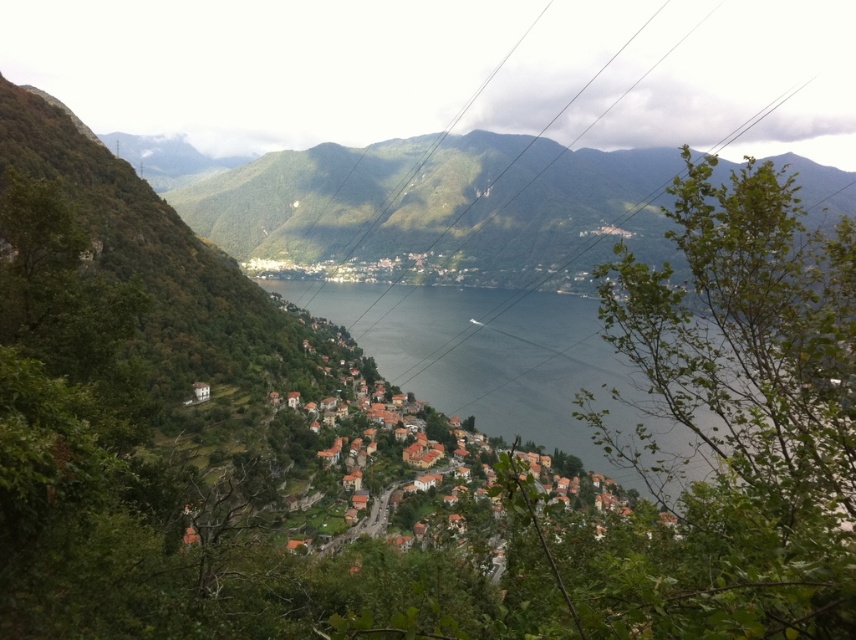
Question: Observing the image, what is the correct spatial positioning of green matte mountain at center in reference to clear water at center?

Choices:
 (A) right
 (B) left

Answer: (A)

Question: Which point is closer to the camera taking this photo?

Choices:
 (A) tap(504, 209)
 (B) tap(409, 364)

Answer: (B)

Question: Can you confirm if green matte mountain at center is smaller than clear water at center?

Choices:
 (A) yes
 (B) no

Answer: (B)

Question: Does green matte mountain at center appear over clear water at center?

Choices:
 (A) yes
 (B) no

Answer: (A)